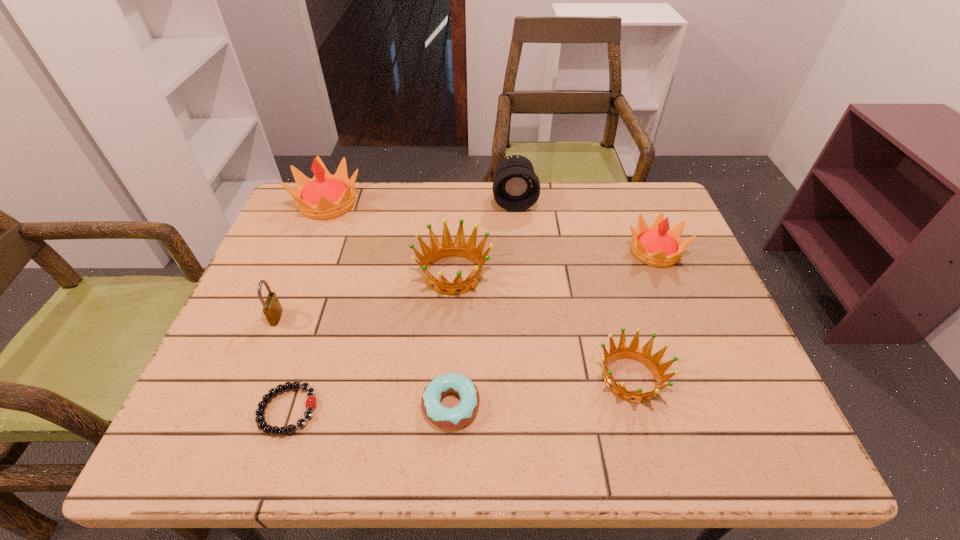
Where is `the right golden crown`? This screenshot has height=540, width=960. the right golden crown is located at coordinates (633, 352).

I want to click on the smaller golden crown, so click(633, 352).

Where is `doughnut`? doughnut is located at coordinates (447, 418).

Find the location of a particular element. the seventh tallest object is located at coordinates (447, 418).

This screenshot has height=540, width=960. I want to click on the shortest object, so click(x=311, y=402).

At what (x,y) coordinates should I click in order to perform the action: click on bracelet. Please return your answer as a coordinate pair (x, y). Looking at the image, I should click on 311,402.

At what (x,y) coordinates should I click in order to perform the action: click on blank space located on the right of the leftmost crown. Please return your answer as a coordinate pair (x, y). Looking at the image, I should click on (425, 203).

You are a GUI agent. You are given a task and a screenshot of the screen. Output one action in this format:
    pyautogui.click(x=<x>, y=<y>)
    Task: Click on the free space located at the front element of the sixth object from left to right
    This screenshot has width=960, height=540.
    Given the screenshot: What is the action you would take?
    pyautogui.click(x=517, y=235)

At what (x,y) coordinates should I click in order to perform the action: click on free space located 0.060m on the front of the right yellow crown. Please return your answer as a coordinate pair (x, y). Image resolution: width=960 pixels, height=540 pixels. Looking at the image, I should click on (670, 290).

Locate an element on the screen. vacant area situated on the back of the fifth farthest object is located at coordinates (298, 266).